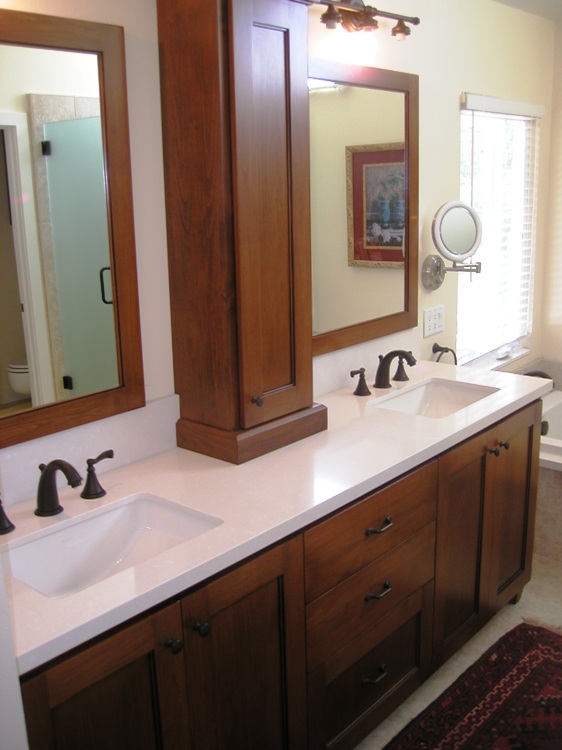
In order to click on floor in this screenshot , I will do `click(548, 588)`.